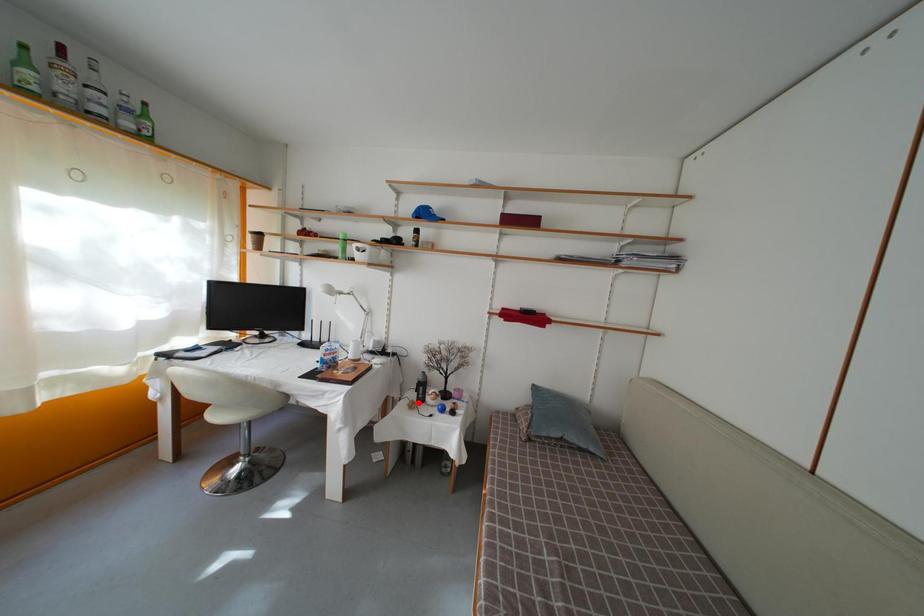
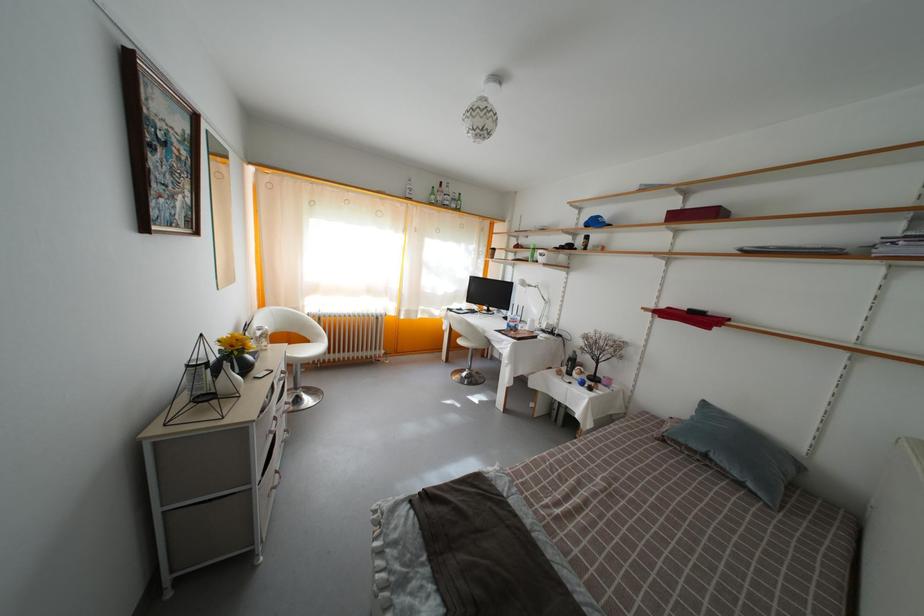
Find the pixel in the second image that matches the highlighted location in the first image.

(569, 376)